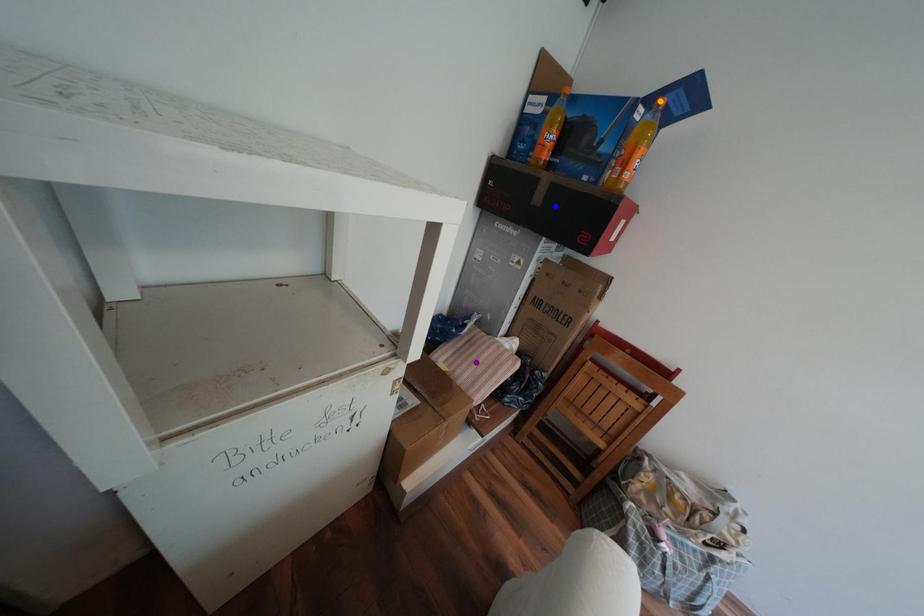
Order these from farthest to nearest:
A) orange point
B) blue point
C) purple point

purple point
blue point
orange point